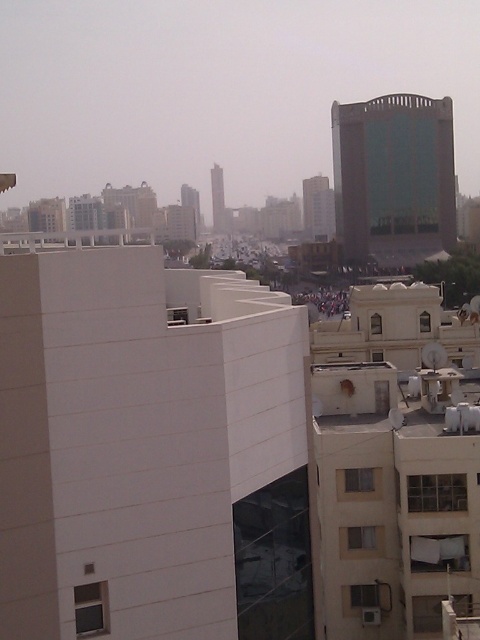
Does point (191, 624) come in front of point (414, 108)?

Yes, point (191, 624) is in front of point (414, 108).

Where is `white smooth building at center`? white smooth building at center is located at coordinates (151, 449).